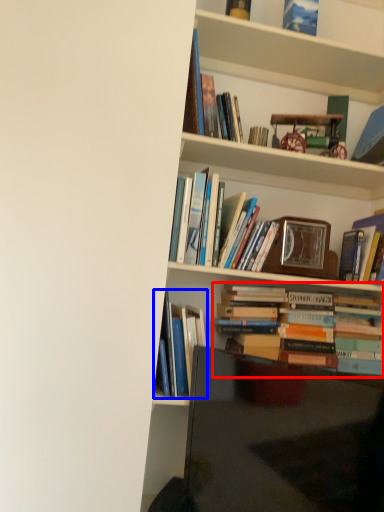
Question: Among these objects, which one is nearest to the camera, book (highlighted by a red box) or book (highlighted by a blue box)?

Choices:
 (A) book
 (B) book

Answer: (B)